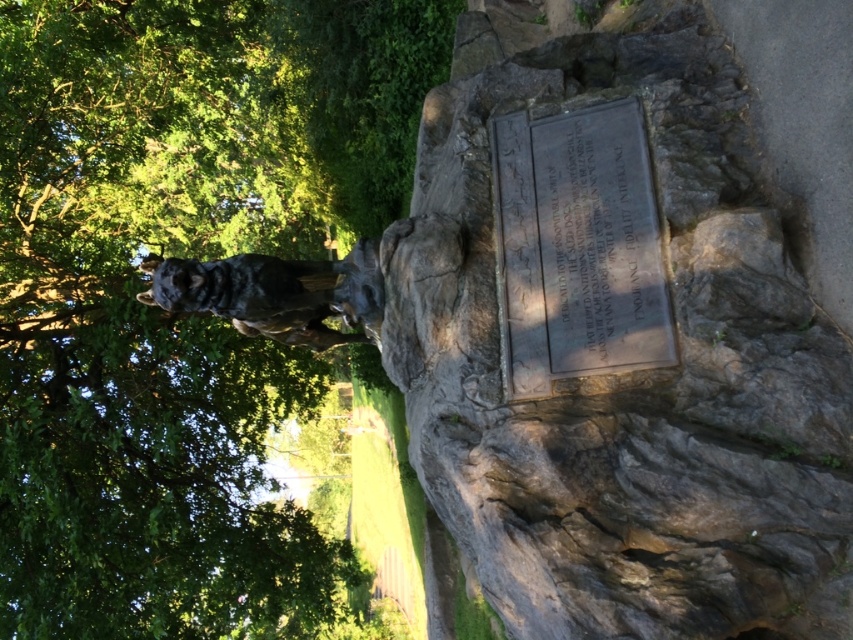
You are standing in front of the statue of a German Shepherd mounted on a rock. There are two points marked on the rock formation. The first point is at coordinates point (82, 147) and the second point is at point (160, 266). Which point is closer to you?

Point (82, 147) is further to the viewer than point (160, 266), so the closer point to you is point (82, 147).

You are a sculptor who wants to create a new statue of a different animal. The new statue will be placed on the gray rough stone at center. If the shiny bronze wolf at center is currently occupying the center of the stone, can you place a larger statue on the stone without moving the existing one?

The gray rough stone at center has a larger width than the shiny bronze wolf at center. Since the stone is wider, you can place a larger statue on it as long as the new statue fits within the remaining space around the existing shiny bronze wolf at center.